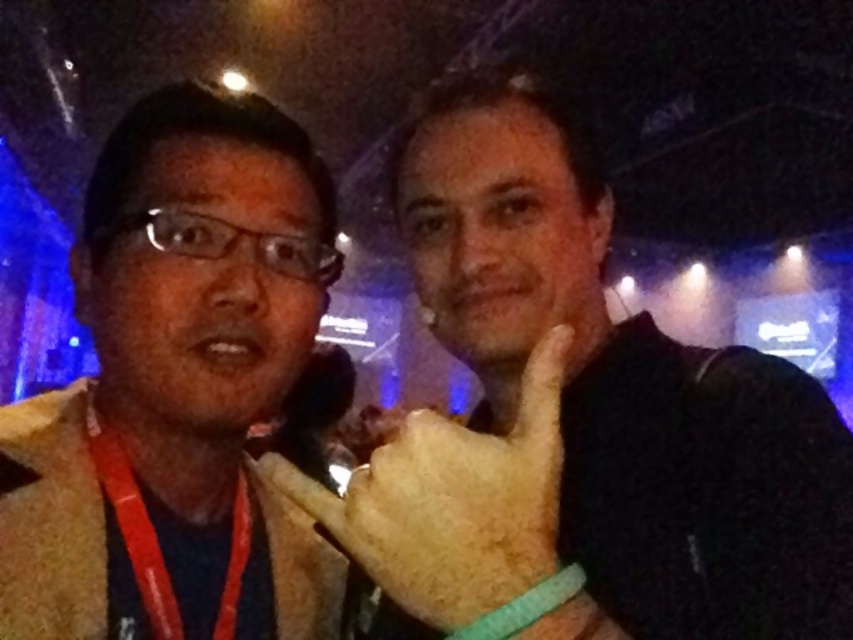
Is fuzzy beige glove at center smaller than red lanyard at left?

No.

Does fuzzy beige glove at center have a greater height compared to red lanyard at left?

No.

Locate an element on the screen. This screenshot has height=640, width=853. fuzzy beige glove at center is located at coordinates (451, 502).

Where is `fuzzy beige glove at center`? The width and height of the screenshot is (853, 640). fuzzy beige glove at center is located at coordinates (451, 502).

Between smooth beige sweater at left and fuzzy beige glove at center, which one is positioned higher?

Positioned higher is smooth beige sweater at left.

Which is below, smooth beige sweater at left or fuzzy beige glove at center?

A: fuzzy beige glove at center is lower down.

Is point (643, 630) positioned before point (550, 340)?

No.

You are a GUI agent. You are given a task and a screenshot of the screen. Output one action in this format:
    pyautogui.click(x=<x>, y=<y>)
    Task: Click on the smooth beige sweater at left
    Image resolution: width=853 pixels, height=640 pixels.
    Given the screenshot: What is the action you would take?
    pyautogui.click(x=579, y=419)

Between dry skin at center and red lanyard at left, which one appears on the left side from the viewer's perspective?

Positioned to the left is red lanyard at left.

Who is lower down, dry skin at center or red lanyard at left?

red lanyard at left is below.

From the picture: Who is more distant from viewer, (572, 337) or (236, 525)?

The point (236, 525) is behind.

Where is `dry skin at center`? This screenshot has width=853, height=640. dry skin at center is located at coordinates (534, 333).